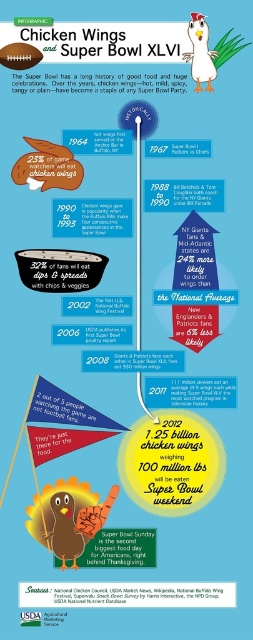
Based on the photo, you are designing a poster and need to place the brown matte turkey at center and the matte brown chicken wings at upper left. Based on their sizes, which object should you scale down to fit the layout better?

The brown matte turkey at center is larger than the matte brown chicken wings at upper left, so you should scale down the brown matte turkey at center to maintain consistency in size.

Based on the spatial arrangement in the infographic, how far apart are the brown matte turkey at center and the matte brown chicken wings at upper left?

The brown matte turkey at center is 18.65 inches away from the matte brown chicken wings at upper left.

You are designing an infographic about Super Bowl snacks and have the brown matte turkey at center and the matte brown chicken wings at upper left. Which object should you adjust to make them the same size?

The brown matte turkey at center is larger than the matte brown chicken wings at upper left, so you should reduce the size of the brown matte turkey at center to match the smaller matte brown chicken wings at upper left.